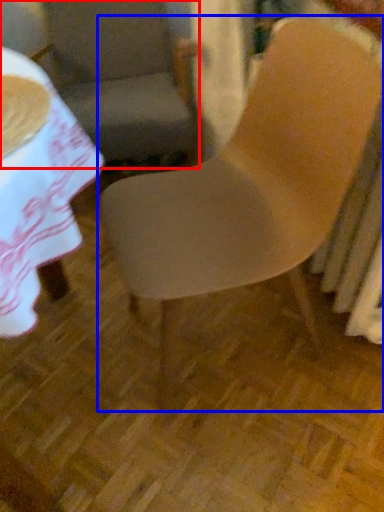
Question: Which point is closer to the camera, chair (highlighted by a red box) or chair (highlighted by a blue box)?

Choices:
 (A) chair
 (B) chair

Answer: (B)